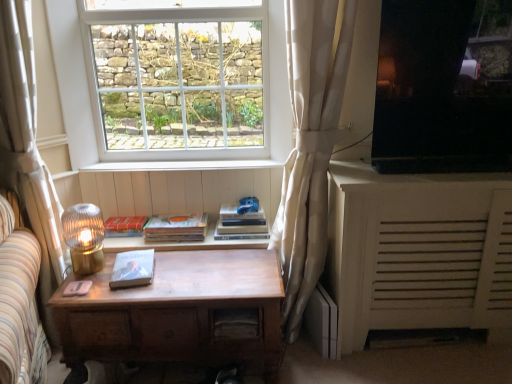
In order to click on free space between gold metallic lamp at left and matte white paperback book at center, marked as the 1th paperback book in a front-to-back arrangement in this screenshot , I will do `click(93, 277)`.